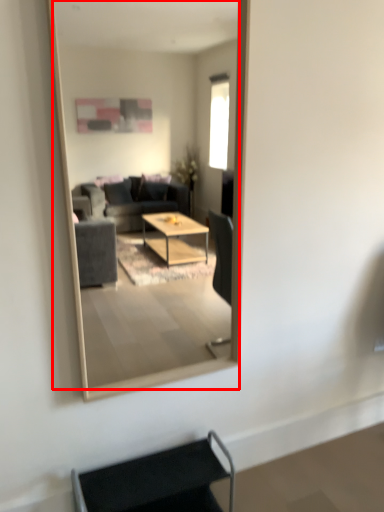
Question: In this image, where is mirror (annotated by the red box) located relative to armchair?

Choices:
 (A) left
 (B) right

Answer: (B)